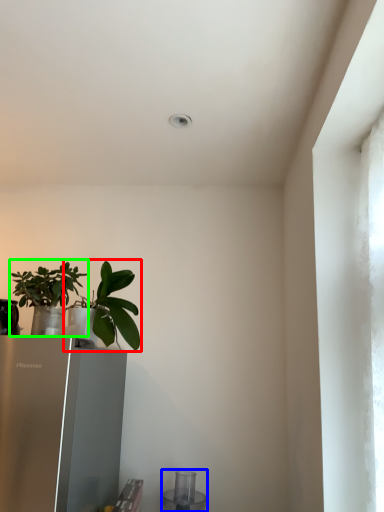
Question: Estimate the real-world distances between objects in this image. Which object is closer to houseplant (highlighted by a red box), appliance (highlighted by a blue box) or houseplant (highlighted by a green box)?

Choices:
 (A) appliance
 (B) houseplant

Answer: (B)